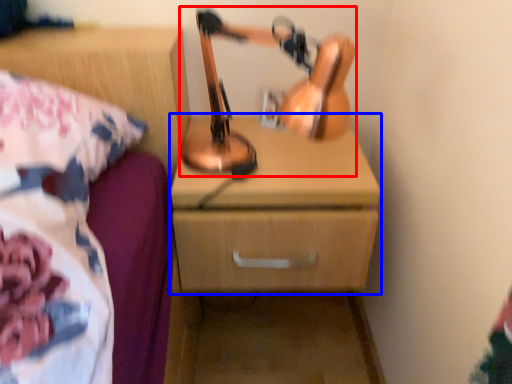
Question: Which point is further to the camera, table lamp (highlighted by a red box) or chest of drawers (highlighted by a blue box)?

Choices:
 (A) table lamp
 (B) chest of drawers

Answer: (B)